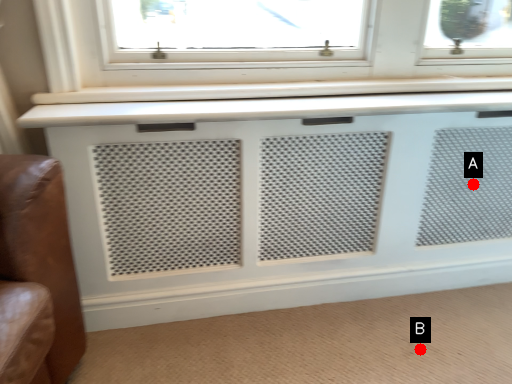
Question: Two points are circled on the image, labeled by A and B beside each circle. Which point is closer to the camera?

Choices:
 (A) A is closer
 (B) B is closer

Answer: (B)